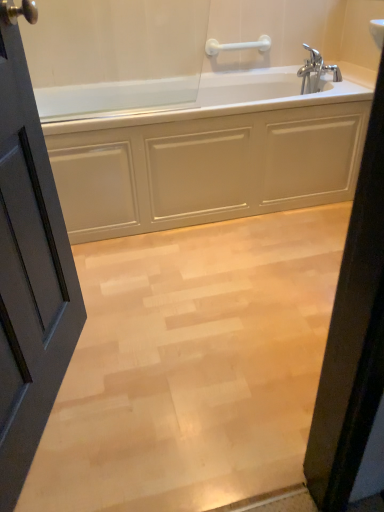
Question: Considering their positions, is light wood floor at center located in front of or behind white glossy bathtub at center?

Choices:
 (A) behind
 (B) front

Answer: (B)

Question: Is light wood floor at center to the left or to the right of white glossy bathtub at center in the image?

Choices:
 (A) right
 (B) left

Answer: (A)

Question: Considering the real-world distances, which object is farthest from the matte gray door at left?

Choices:
 (A) chrome metallic faucet at upper right
 (B) white plastic towel bar at upper center
 (C) white glossy bathtub at center
 (D) light wood floor at center

Answer: (A)

Question: Which of these objects is positioned farthest from the white glossy bathtub at center?

Choices:
 (A) chrome metallic faucet at upper right
 (B) white plastic towel bar at upper center
 (C) light wood floor at center
 (D) matte gray door at left

Answer: (D)